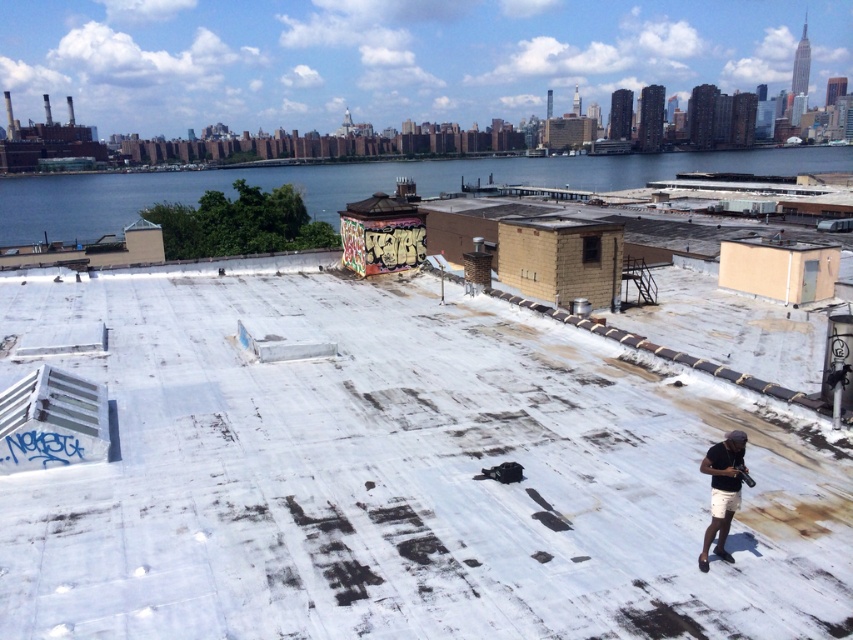
Question: Which point is closer to the camera?

Choices:
 (A) (751, 154)
 (B) (314, 566)

Answer: (B)

Question: Observing the image, what is the correct spatial positioning of white matte roof at center in reference to blue water at upper center?

Choices:
 (A) left
 (B) right

Answer: (A)

Question: Is white matte roof at center to the left of dark gray matte shorts at lower right from the viewer's perspective?

Choices:
 (A) no
 (B) yes

Answer: (B)

Question: Which point is closer to the camera taking this photo?

Choices:
 (A) (675, 164)
 (B) (102, 284)

Answer: (B)

Question: Does blue water at upper center appear over dark gray matte shorts at lower right?

Choices:
 (A) yes
 (B) no

Answer: (A)

Question: Among these points, which one is nearest to the camera?

Choices:
 (A) pyautogui.click(x=345, y=172)
 (B) pyautogui.click(x=726, y=499)
 (C) pyautogui.click(x=410, y=289)

Answer: (B)